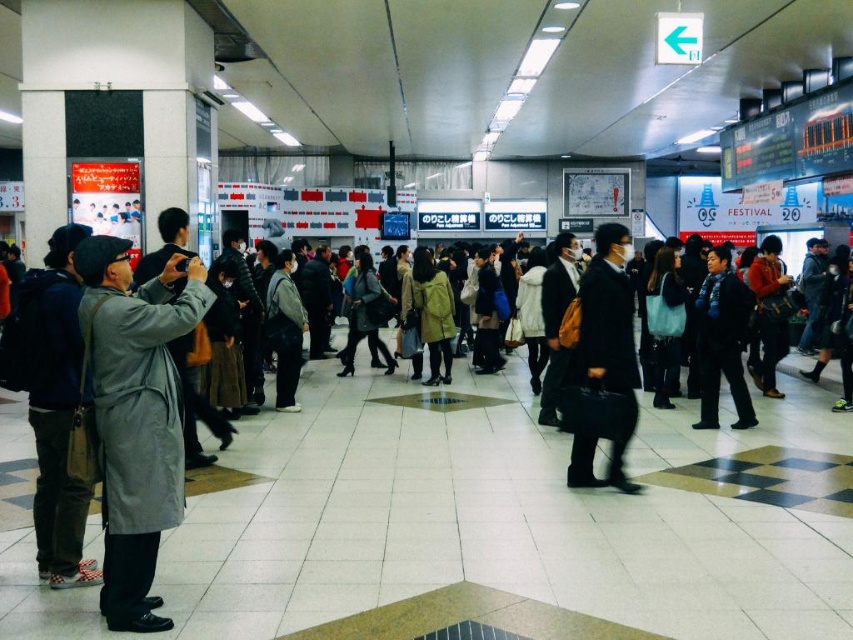
You are a person standing in the train station and you want to know which object is shorter between the gray matte coat at left and the black leather briefcase at center. Can you tell me?

The gray matte coat at left has a lesser height compared to the black leather briefcase at center, so the gray matte coat at left is shorter.

You are a person standing in the train station and you see the gray matte coat at left and the black leather briefcase at center. Which object is nearer to you?

The gray matte coat at left is closer to the viewer than the black leather briefcase at center.